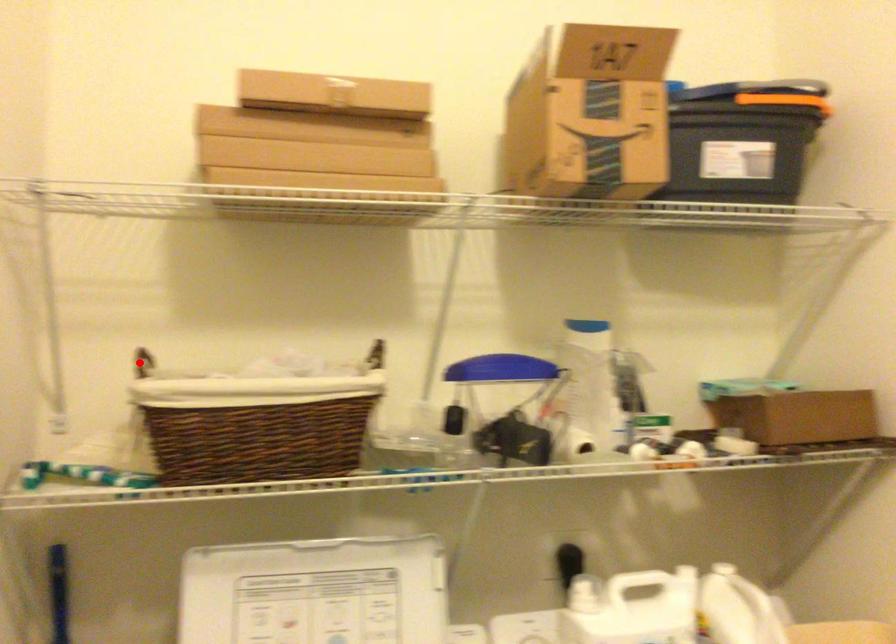
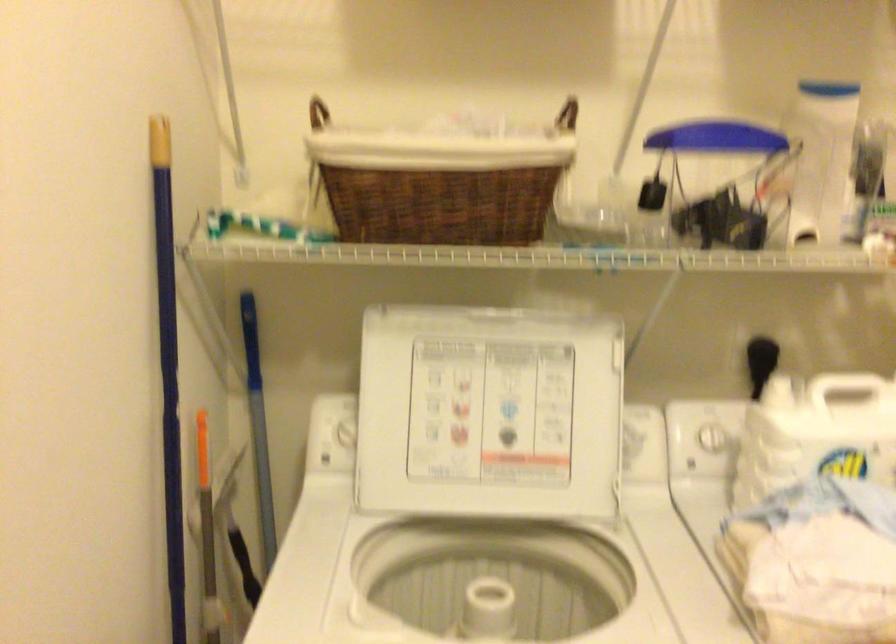
Where in the second image is the point corresponding to the highlighted location from the first image?

(317, 113)